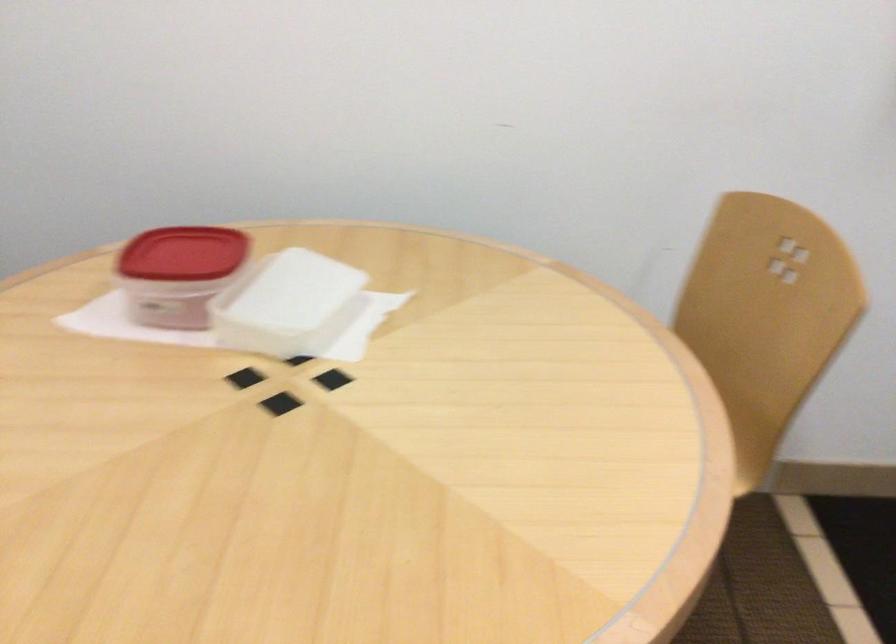
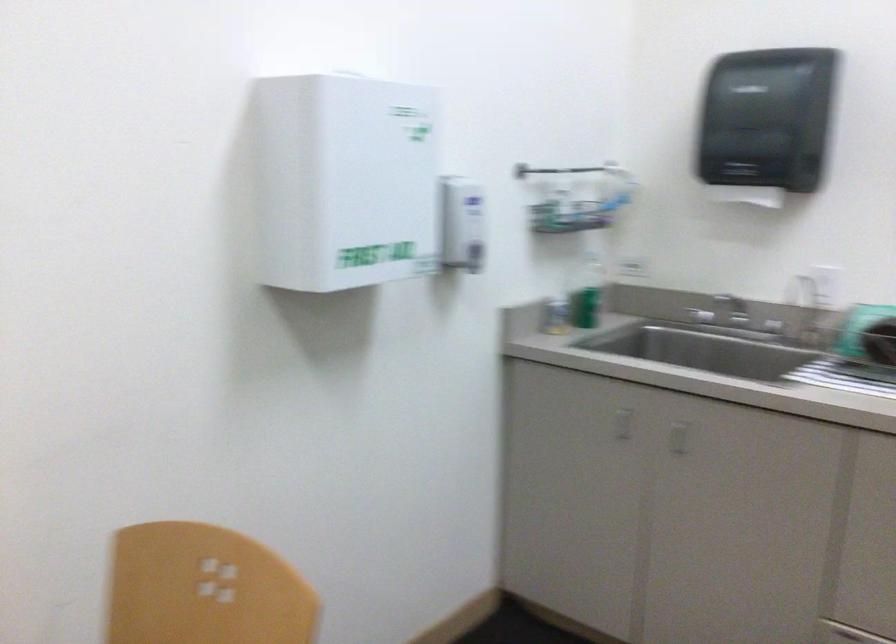
Question: The camera is either moving clockwise (left) or counter-clockwise (right) around the object. The first image is from the beginning of the video and the second image is from the end. Is the camera moving left or right when shooting the video?

Choices:
 (A) Left
 (B) Right

Answer: (A)